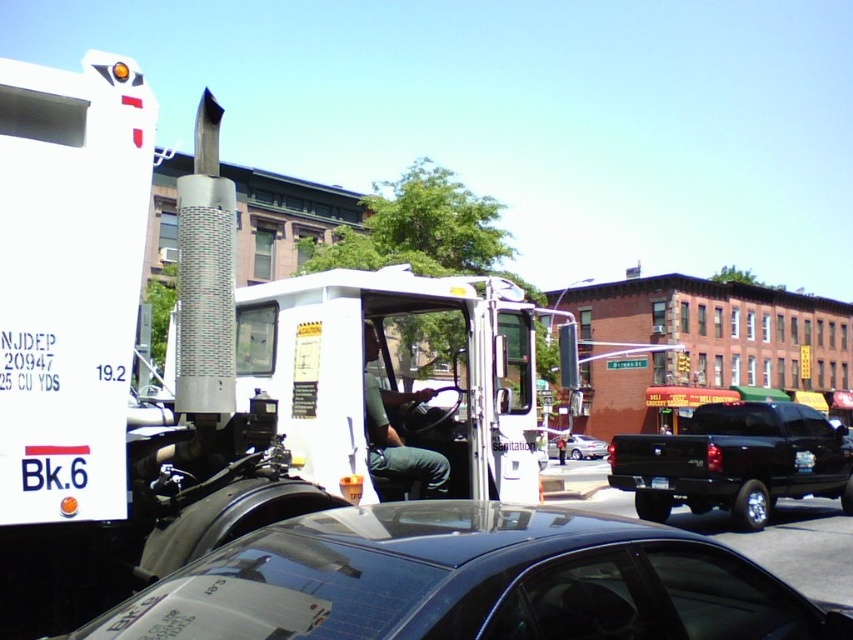
Is point (349, 593) positioned after point (717, 472)?

No, it is in front of (717, 472).

Is glossy black car at center positioned at the back of black matte truck at right?

No, glossy black car at center is closer to the viewer.

Which is behind, point (358, 541) or point (715, 502)?

The point (715, 502) is more distant.

The height and width of the screenshot is (640, 853). I want to click on glossy black car at center, so click(469, 580).

Does glossy black car at center have a smaller size compared to shiny silver sedan at center?

Yes.

Can you confirm if glossy black car at center is shorter than shiny silver sedan at center?

Yes, glossy black car at center is shorter than shiny silver sedan at center.

Is point (167, 609) behind point (547, 444)?

That is False.

Find the location of a particular element. This screenshot has width=853, height=640. glossy black car at center is located at coordinates (469, 580).

Is point (822, 460) positioned before point (583, 445)?

Yes, point (822, 460) is closer to viewer.

Which is more to the right, black matte truck at right or shiny silver sedan at center?

black matte truck at right

Image resolution: width=853 pixels, height=640 pixels. I want to click on black matte truck at right, so click(x=735, y=461).